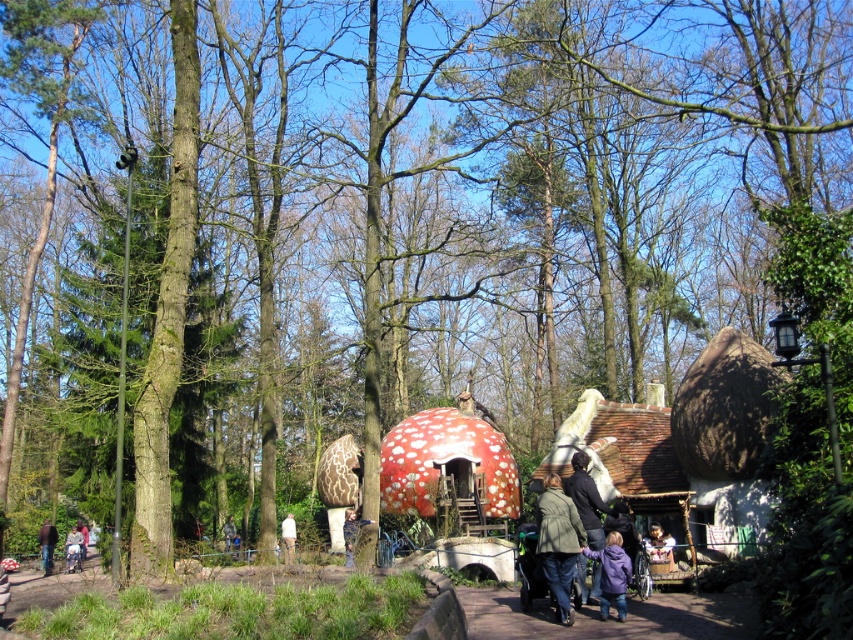
Is the position of brown leather jacket at center less distant than that of white cotton shirt at center?

Yes, it is.

Is brown leather jacket at center bigger than white cotton shirt at center?

No.

Is point (670, 538) positioned after point (286, 563)?

No, it is not.

Image resolution: width=853 pixels, height=640 pixels. Identify the location of brown leather jacket at center. (659, 545).

How distant is brown leather jacket at lower left from dark brown leather jacket at lower left?

brown leather jacket at lower left and dark brown leather jacket at lower left are 2.20 meters apart.

Is point (53, 548) less distant than point (82, 541)?

Yes, it is in front of point (82, 541).

Image resolution: width=853 pixels, height=640 pixels. I want to click on brown leather jacket at lower left, so click(x=47, y=545).

Measure the distance between point [679,499] and camera.

Point [679,499] is 123.04 feet away from camera.

Does white thatched roof hut at center have a greater height compared to brown leather jacket at center?

Yes, white thatched roof hut at center is taller than brown leather jacket at center.

Is point (619, 433) farther from viewer compared to point (665, 556)?

Yes.

The height and width of the screenshot is (640, 853). In order to click on white thatched roof hut at center in this screenshot , I will do `click(624, 456)`.